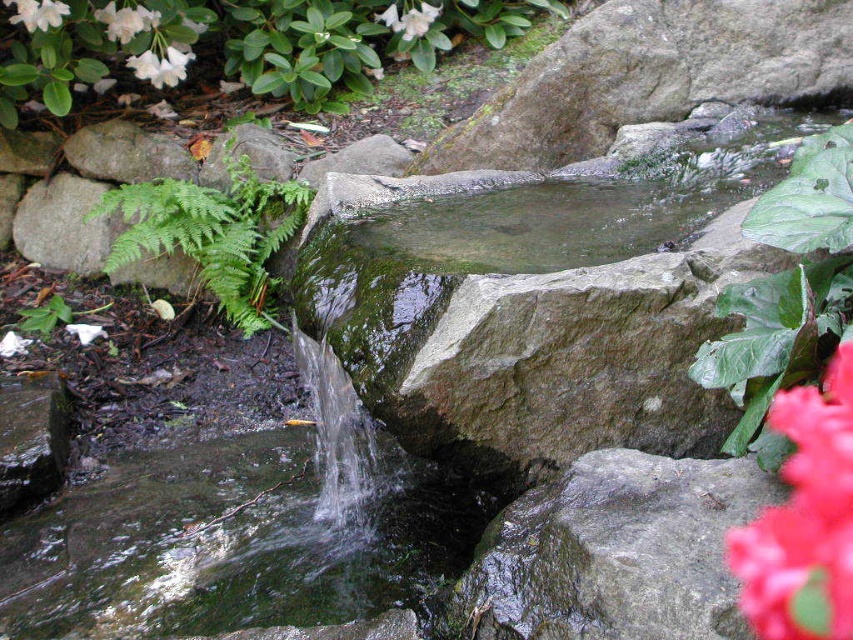
Is point (465, 609) closer to camera compared to point (251, 180)?

Yes.

Who is higher up, gray rough rock at center or green leafy fern at left?

green leafy fern at left

Find the location of a particular element. Image resolution: width=853 pixels, height=640 pixels. gray rough rock at center is located at coordinates (614, 552).

Locate an element on the screen. The height and width of the screenshot is (640, 853). gray rough rock at center is located at coordinates pyautogui.click(x=614, y=552).

Who is more distant from viewer, (300, 564) or (294, 180)?

The point (294, 180) is more distant.

Is clear water stream at center positioned at the back of green leafy fern at left?

No, it is not.

Who is more forward, (x=103, y=572) or (x=136, y=244)?

Point (x=103, y=572)

Locate an element on the screen. Image resolution: width=853 pixels, height=640 pixels. clear water stream at center is located at coordinates (235, 541).

Which is more to the right, white glossy flowers at upper left or white matte flower at upper left?

white glossy flowers at upper left is more to the right.

Can you confirm if white glossy flowers at upper left is bigger than white matte flower at upper left?

Yes, white glossy flowers at upper left is bigger than white matte flower at upper left.

Is point (225, 6) behind point (42, 4)?

Yes.

This screenshot has width=853, height=640. What are the coordinates of `white glossy flowers at upper left` in the screenshot? It's located at (248, 44).